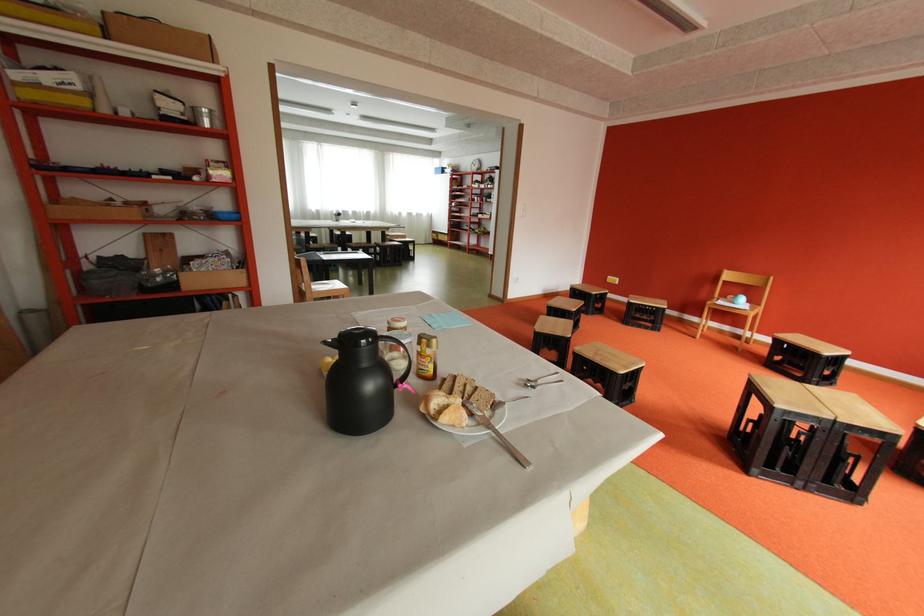
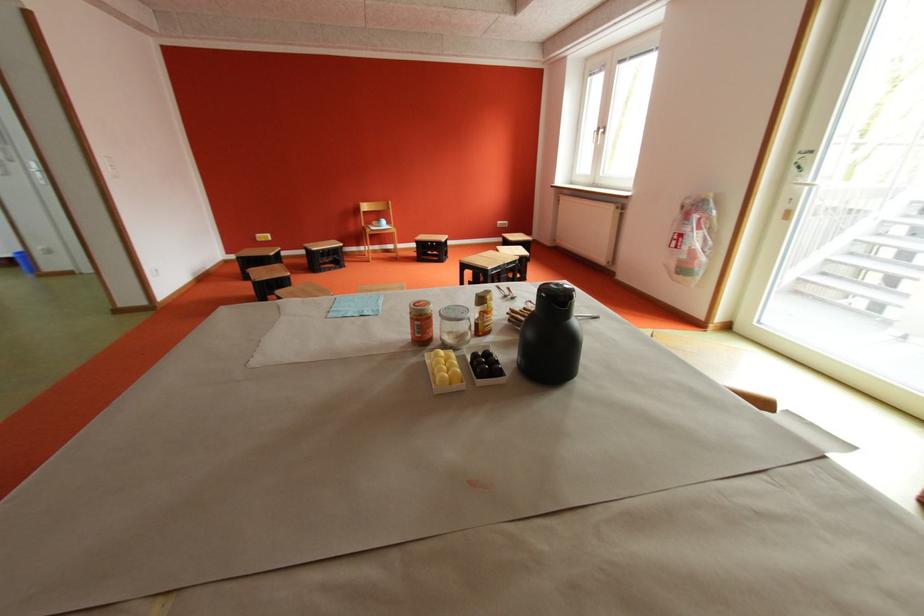
Find the pixel in the second image that matches point (730, 302) in the first image.

(383, 229)